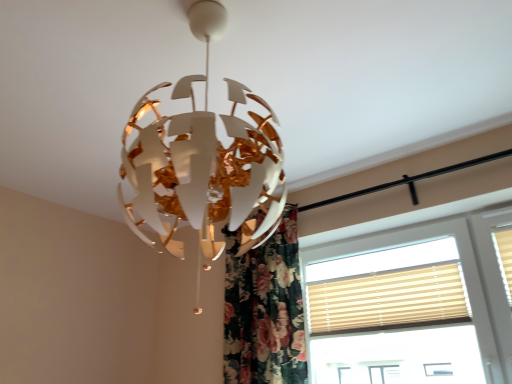
Question: Should I look upward or downward to see beige fabric window at right?

Choices:
 (A) down
 (B) up

Answer: (A)

Question: Would you say beige fabric window at right contains beige fabric blinds at right?

Choices:
 (A) yes
 (B) no

Answer: (A)

Question: From the image's perspective, is beige fabric window at right over beige fabric blinds at right?

Choices:
 (A) yes
 (B) no

Answer: (A)

Question: Does beige fabric window at right have a greater width compared to beige fabric blinds at right?

Choices:
 (A) no
 (B) yes

Answer: (B)

Question: Could you tell me if beige fabric window at right is facing beige fabric blinds at right?

Choices:
 (A) no
 (B) yes

Answer: (B)

Question: Can you confirm if beige fabric window at right is positioned to the left of beige fabric blinds at right?

Choices:
 (A) yes
 (B) no

Answer: (B)

Question: Is beige fabric window at right taller than beige fabric blinds at right?

Choices:
 (A) no
 (B) yes

Answer: (B)

Question: Can you see beige fabric blinds at right touching beige fabric window at right?

Choices:
 (A) no
 (B) yes

Answer: (B)

Question: Is beige fabric blinds at right to the right of beige fabric window at right from the viewer's perspective?

Choices:
 (A) yes
 (B) no

Answer: (B)

Question: Does beige fabric blinds at right have a lesser width compared to beige fabric window at right?

Choices:
 (A) no
 (B) yes

Answer: (B)

Question: Is beige fabric blinds at right in front of beige fabric window at right?

Choices:
 (A) no
 (B) yes

Answer: (A)

Question: Can you confirm if beige fabric blinds at right is wider than beige fabric window at right?

Choices:
 (A) yes
 (B) no

Answer: (B)

Question: Is beige fabric blinds at right taller than beige fabric window at right?

Choices:
 (A) no
 (B) yes

Answer: (A)

Question: Does floral fabric curtain at center have a larger size compared to beige fabric window at right?

Choices:
 (A) yes
 (B) no

Answer: (A)